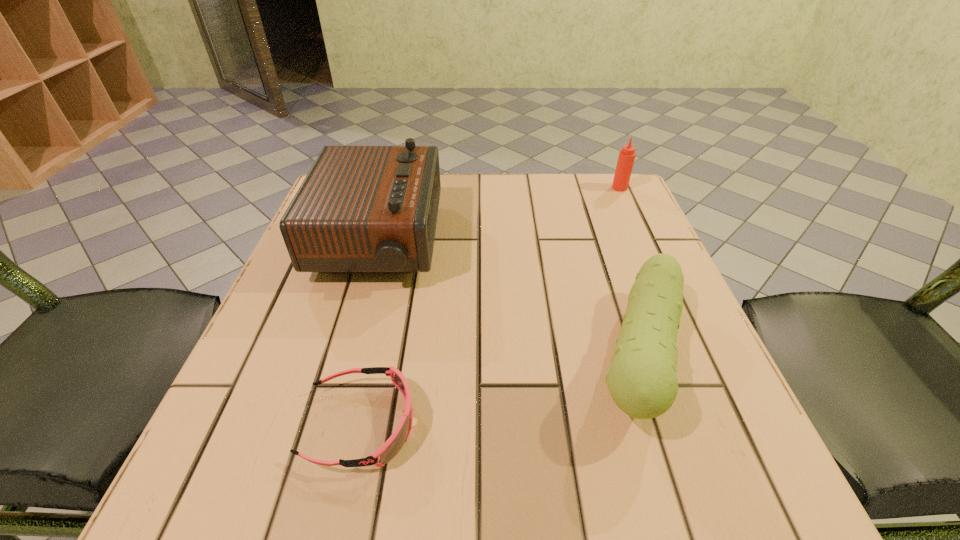
The image size is (960, 540). What are the coordinates of `cucumber that is at the near edge` in the screenshot? It's located at (642, 380).

I want to click on goggles that is at the near edge, so click(393, 445).

Locate an element on the screen. radio receiver present at the left edge is located at coordinates (361, 209).

The width and height of the screenshot is (960, 540). What are the coordinates of `goggles located in the left edge section of the desktop` in the screenshot? It's located at (393, 445).

Locate an element on the screen. Tabasco sauce that is at the right edge is located at coordinates (626, 158).

The image size is (960, 540). I want to click on cucumber at the right edge, so click(x=642, y=380).

In order to click on object present at the far left corner in this screenshot , I will do `click(361, 209)`.

Identify the location of object present at the near left corner. The image size is (960, 540). pyautogui.click(x=393, y=445).

Locate an element on the screen. object that is at the far right corner is located at coordinates (626, 158).

Where is `object situated at the near right corner`? The height and width of the screenshot is (540, 960). object situated at the near right corner is located at coordinates (642, 380).